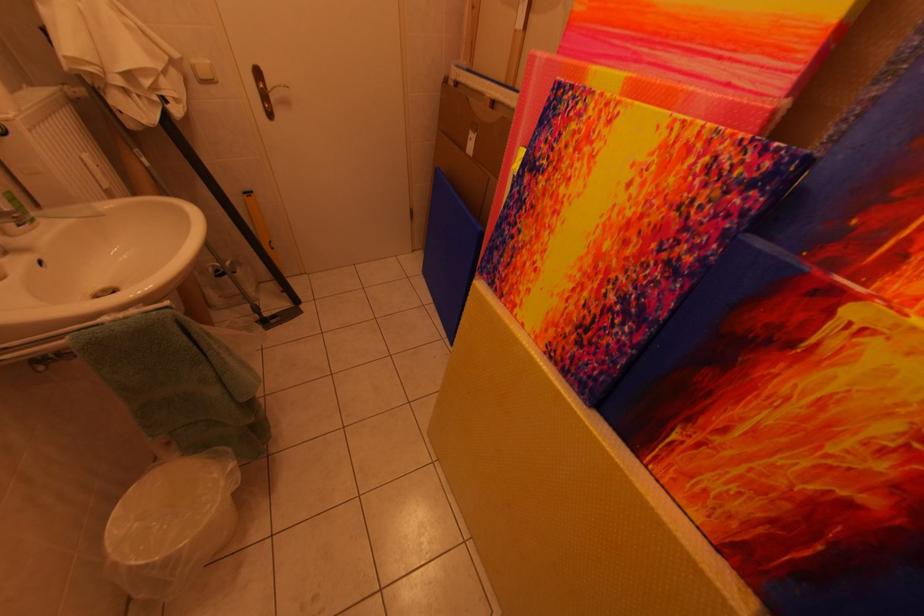
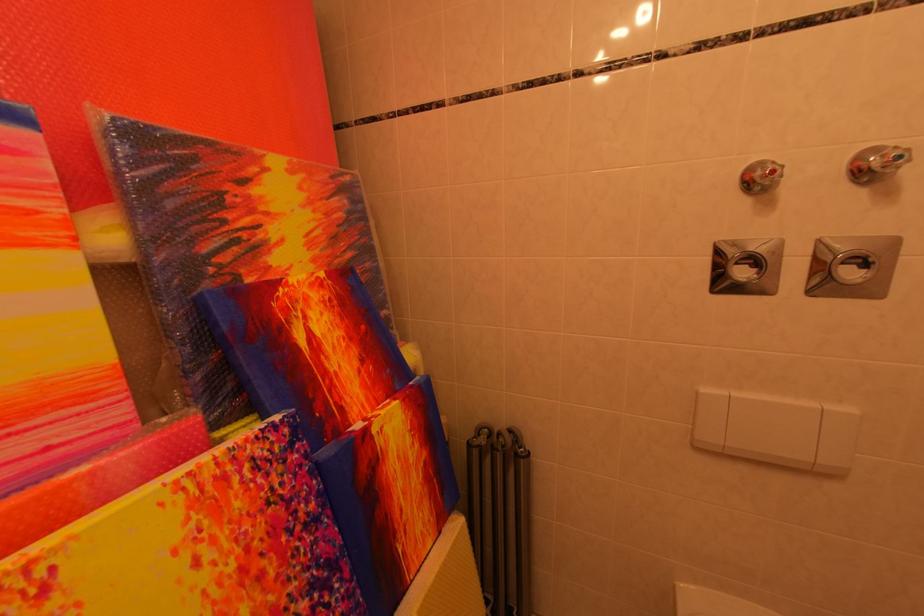
Find the pixel in the second image that matches point (638, 254) in the first image.

(281, 575)